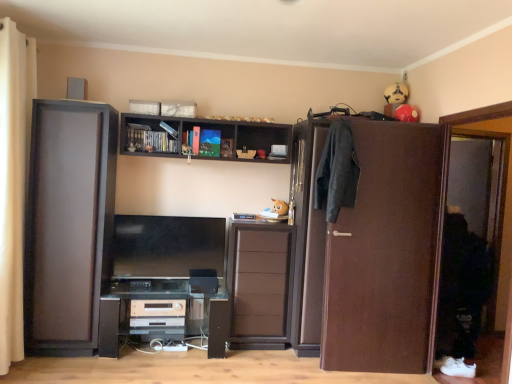
Question: From the image's perspective, is black plastic computer desk at lower center above brown matte cabinet at center?

Choices:
 (A) no
 (B) yes

Answer: (A)

Question: Is black plastic computer desk at lower center outside of brown matte cabinet at center?

Choices:
 (A) no
 (B) yes

Answer: (B)

Question: Is black plastic computer desk at lower center further to the viewer compared to brown matte cabinet at center?

Choices:
 (A) yes
 (B) no

Answer: (B)

Question: Can you see black plastic computer desk at lower center touching brown matte cabinet at center?

Choices:
 (A) yes
 (B) no

Answer: (B)

Question: Is black plastic computer desk at lower center bigger than brown matte cabinet at center?

Choices:
 (A) yes
 (B) no

Answer: (A)

Question: Is brown matte cabinet at center at the back of black plastic computer desk at lower center?

Choices:
 (A) no
 (B) yes

Answer: (A)

Question: Would you consider dark gray fabric coat at right to be distant from satin black speaker at center, placed as the second appliance when sorted from bottom to top?

Choices:
 (A) yes
 (B) no

Answer: (A)

Question: Can satin black speaker at center, marked as the second appliance in a left-to-right arrangement, be found inside dark gray fabric coat at right?

Choices:
 (A) no
 (B) yes

Answer: (A)

Question: Is dark gray fabric coat at right bigger than satin black speaker at center, which is the first appliance in top-to-bottom order?

Choices:
 (A) yes
 (B) no

Answer: (A)

Question: Is dark gray fabric coat at right to the right of satin black speaker at center, marked as the second appliance in a left-to-right arrangement, from the viewer's perspective?

Choices:
 (A) yes
 (B) no

Answer: (A)

Question: From the image's perspective, is dark gray fabric coat at right over satin black speaker at center, which appears as the 1th appliance when viewed from the right?

Choices:
 (A) yes
 (B) no

Answer: (A)

Question: From a real-world perspective, is dark gray fabric coat at right positioned over satin black speaker at center, which is the first appliance in top-to-bottom order, based on gravity?

Choices:
 (A) no
 (B) yes

Answer: (B)

Question: Is dark wood shelf at upper center smaller than black plastic computer desk at lower center?

Choices:
 (A) no
 (B) yes

Answer: (B)